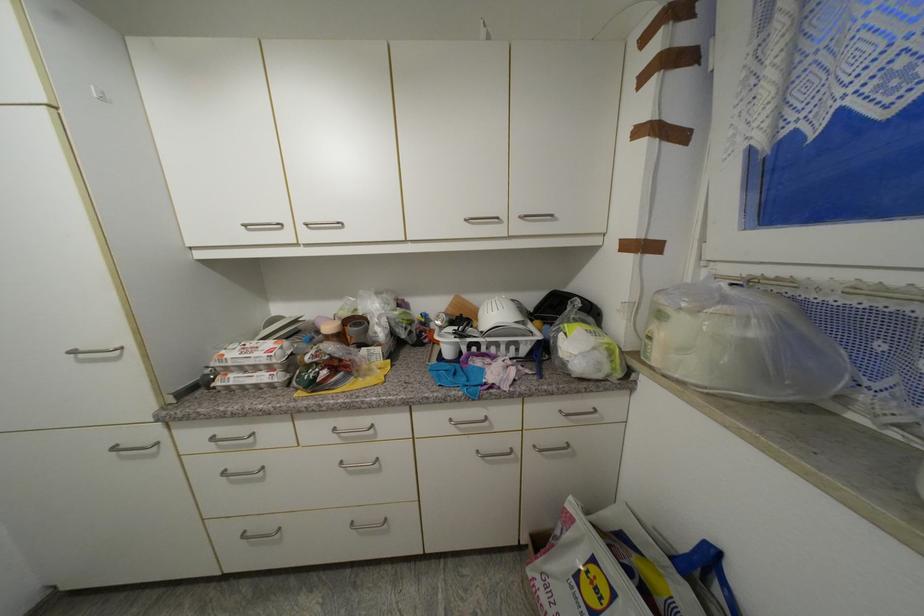
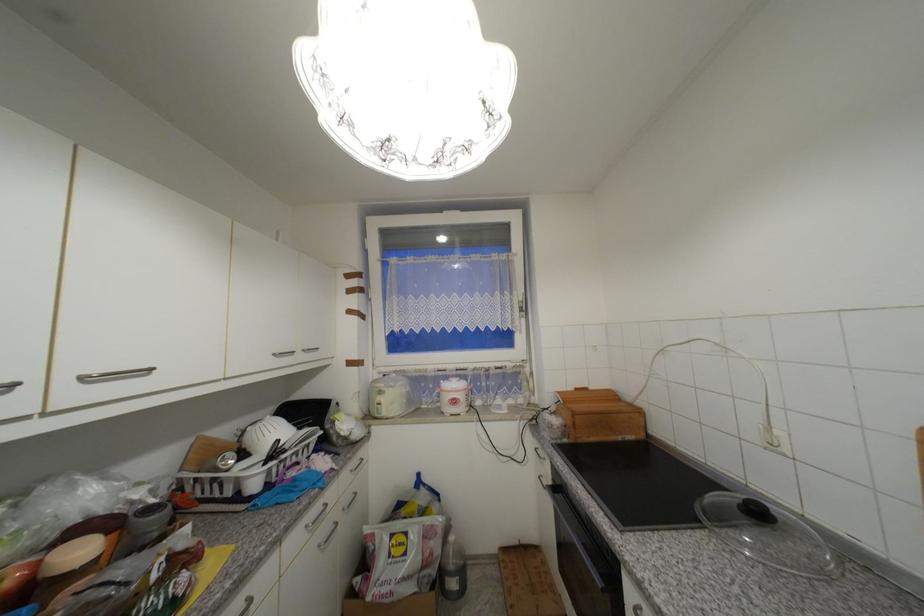
The point at (492, 444) is marked in the first image. Where is the corresponding point in the second image?

(330, 531)